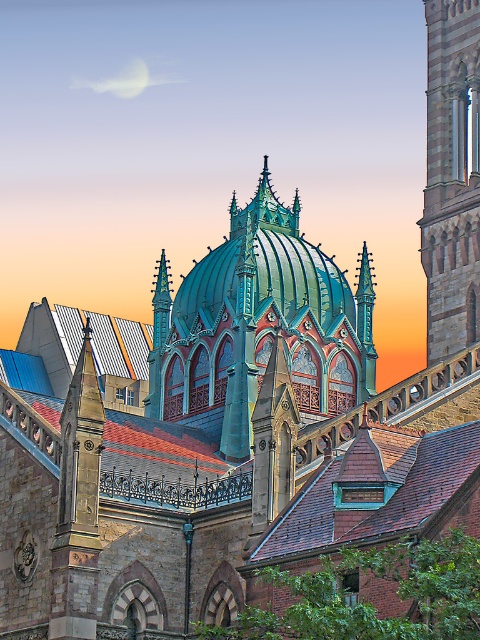
Can you confirm if teal metallic dome at center is bigger than stone tower at right?

No, teal metallic dome at center is not bigger than stone tower at right.

Which of these two, teal metallic dome at center or stone tower at right, stands shorter?

Standing shorter between the two is teal metallic dome at center.

The image size is (480, 640). Find the location of `teal metallic dome at center`. teal metallic dome at center is located at coordinates coord(259,326).